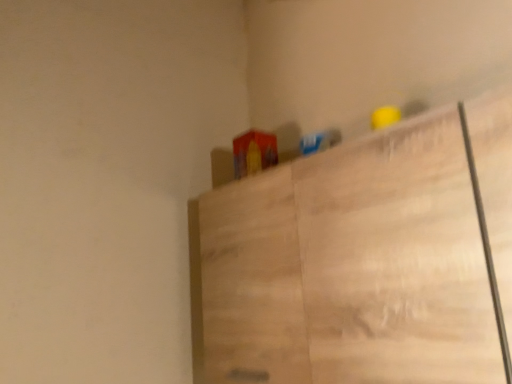
Image resolution: width=512 pixels, height=384 pixels. What are the coordinates of `light wood cabinet at upper right` in the screenshot? It's located at 362,259.

Measure the distance between light wood cabinet at upper right and camera.

The depth of light wood cabinet at upper right is 25.16 inches.

Describe the element at coordinates (362, 259) in the screenshot. I see `light wood cabinet at upper right` at that location.

You are a GUI agent. You are given a task and a screenshot of the screen. Output one action in this format:
    pyautogui.click(x=<x>, y=<y>)
    Task: Click on the light wood cabinet at upper right
    This screenshot has width=512, height=384.
    Given the screenshot: What is the action you would take?
    pyautogui.click(x=362, y=259)